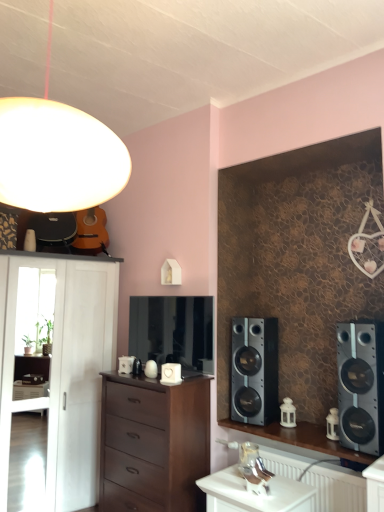
Question: Is satin silver speaker at right, arranged as the second speaker when viewed from the front, inside white matte cabinet at left?

Choices:
 (A) no
 (B) yes

Answer: (A)

Question: From a real-world perspective, does white matte cabinet at left stand above satin silver speaker at right, arranged as the second speaker when viewed from the front?

Choices:
 (A) yes
 (B) no

Answer: (B)

Question: Considering the relative sizes of white matte cabinet at left and satin silver speaker at right, arranged as the second speaker when viewed from the front, in the image provided, is white matte cabinet at left taller than satin silver speaker at right, arranged as the second speaker when viewed from the front,?

Choices:
 (A) no
 (B) yes

Answer: (B)

Question: Considering the relative sizes of white matte cabinet at left and satin silver speaker at right, acting as the second speaker starting from the right, in the image provided, is white matte cabinet at left smaller than satin silver speaker at right, acting as the second speaker starting from the right,?

Choices:
 (A) no
 (B) yes

Answer: (A)

Question: Is white matte cabinet at left in front of satin silver speaker at right, which appears as the 1th speaker when viewed from the left?

Choices:
 (A) no
 (B) yes

Answer: (B)

Question: Is white matte cabinet at left not inside satin silver speaker at right, arranged as the second speaker when viewed from the front?

Choices:
 (A) no
 (B) yes

Answer: (B)

Question: Does white glossy table at lower center have a lesser width compared to matte white globe at upper left?

Choices:
 (A) no
 (B) yes

Answer: (B)

Question: Does white glossy table at lower center have a larger size compared to matte white globe at upper left?

Choices:
 (A) no
 (B) yes

Answer: (A)

Question: From a real-world perspective, is white glossy table at lower center located beneath matte white globe at upper left?

Choices:
 (A) no
 (B) yes

Answer: (B)

Question: Could you tell me if white glossy table at lower center is facing matte white globe at upper left?

Choices:
 (A) yes
 (B) no

Answer: (B)

Question: From a real-world perspective, is white glossy table at lower center on matte white globe at upper left?

Choices:
 (A) no
 (B) yes

Answer: (A)

Question: Considering the relative positions of white glossy table at lower center and matte white globe at upper left in the image provided, is white glossy table at lower center to the left of matte white globe at upper left from the viewer's perspective?

Choices:
 (A) no
 (B) yes

Answer: (A)

Question: Does matte white globe at upper left have a greater height compared to satin silver speaker at right, acting as the second speaker starting from the right?

Choices:
 (A) no
 (B) yes

Answer: (B)